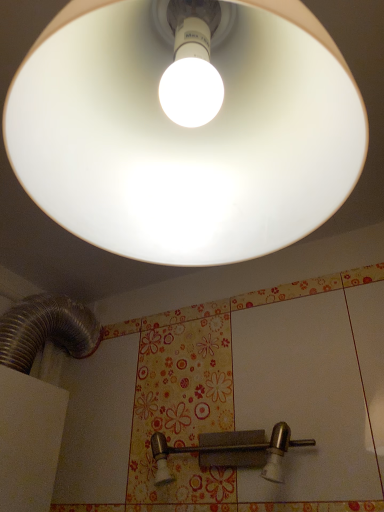
Question: In terms of size, does matte white lampshade at upper center appear bigger or smaller than satin nickel lever at lower center?

Choices:
 (A) small
 (B) big

Answer: (B)

Question: From the image's perspective, is matte white lampshade at upper center above or below satin nickel lever at lower center?

Choices:
 (A) below
 (B) above

Answer: (B)

Question: Is matte white lampshade at upper center situated inside satin nickel lever at lower center or outside?

Choices:
 (A) inside
 (B) outside

Answer: (B)

Question: Is point (266, 451) closer or farther from the camera than point (248, 185)?

Choices:
 (A) closer
 (B) farther

Answer: (B)

Question: From the image's perspective, is satin nickel lever at lower center positioned above or below matte white lampshade at upper center?

Choices:
 (A) below
 (B) above

Answer: (A)

Question: Is satin nickel lever at lower center spatially inside matte white lampshade at upper center, or outside of it?

Choices:
 (A) outside
 (B) inside

Answer: (A)

Question: Is satin nickel lever at lower center wider or thinner than matte white lampshade at upper center?

Choices:
 (A) thin
 (B) wide

Answer: (A)